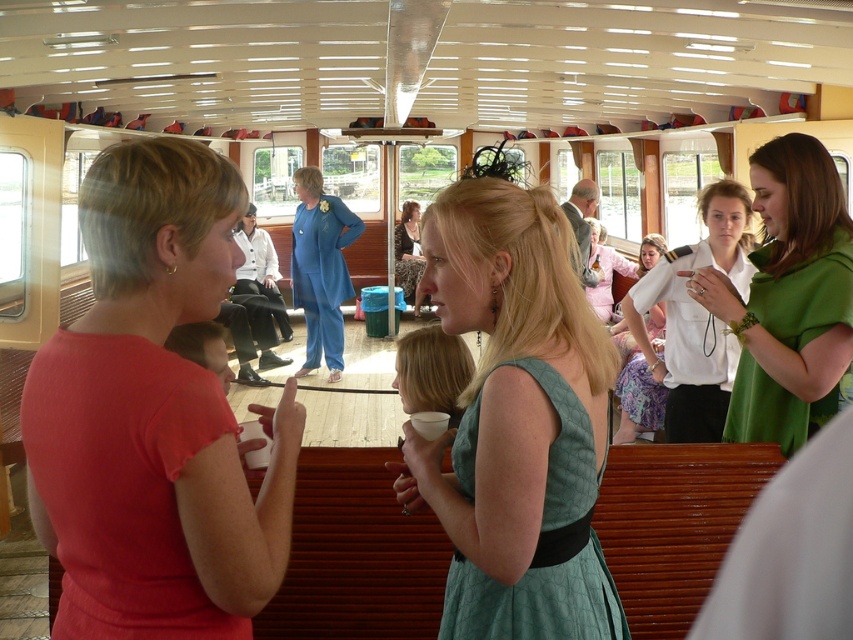
Question: Does white shirt at center have a larger size compared to matte blue suit at center?

Choices:
 (A) no
 (B) yes

Answer: (A)

Question: Can you confirm if white shirt at center is positioned to the right of matte blue suit at center?

Choices:
 (A) yes
 (B) no

Answer: (A)

Question: Which point is farther from the camera taking this photo?

Choices:
 (A) (656, 337)
 (B) (701, 372)
 (C) (467, 577)
 (D) (846, 212)

Answer: (A)

Question: Is green fabric dress at center behind patterned fabric dress at center?

Choices:
 (A) no
 (B) yes

Answer: (A)

Question: Which point appears closest to the camera in this image?

Choices:
 (A) [x=401, y=236]
 (B) [x=105, y=611]
 (C) [x=303, y=300]
 (D) [x=572, y=376]

Answer: (B)

Question: Considering the real-world distances, which object is farthest from the white shirt at center?

Choices:
 (A) patterned fabric dress at center
 (B) matte red shirt at left
 (C) matte blue suit at center

Answer: (A)